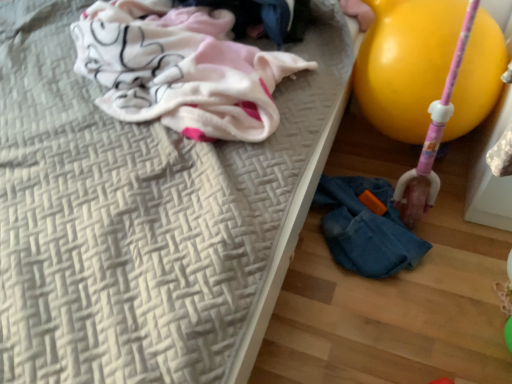
Question: Is denim jacket at lower right not within yellow rubber balloon at right?

Choices:
 (A) yes
 (B) no

Answer: (A)

Question: Can you confirm if denim jacket at lower right is positioned to the right of yellow rubber balloon at right?

Choices:
 (A) yes
 (B) no

Answer: (B)

Question: Considering the relative positions of denim jacket at lower right and yellow rubber balloon at right in the image provided, is denim jacket at lower right in front of yellow rubber balloon at right?

Choices:
 (A) yes
 (B) no

Answer: (B)

Question: Is denim jacket at lower right directly adjacent to yellow rubber balloon at right?

Choices:
 (A) no
 (B) yes

Answer: (A)

Question: Considering the relative sizes of denim jacket at lower right and yellow rubber balloon at right in the image provided, is denim jacket at lower right smaller than yellow rubber balloon at right?

Choices:
 (A) no
 (B) yes

Answer: (B)

Question: From a real-world perspective, relative to yellow rubber balloon at right, is denim jacket at lower right vertically above or below?

Choices:
 (A) above
 (B) below

Answer: (B)

Question: Is denim jacket at lower right in front of or behind yellow rubber balloon at right in the image?

Choices:
 (A) behind
 (B) front

Answer: (A)

Question: Considering the positions of denim jacket at lower right and yellow rubber balloon at right in the image, is denim jacket at lower right wider or thinner than yellow rubber balloon at right?

Choices:
 (A) wide
 (B) thin

Answer: (A)

Question: Is denim jacket at lower right spatially inside yellow rubber balloon at right, or outside of it?

Choices:
 (A) outside
 (B) inside

Answer: (A)

Question: Considering their positions, is yellow rubber balloon at right located in front of or behind denim jacket at lower right?

Choices:
 (A) behind
 (B) front

Answer: (B)

Question: Considering the positions of yellow rubber balloon at right and denim jacket at lower right in the image, is yellow rubber balloon at right bigger or smaller than denim jacket at lower right?

Choices:
 (A) small
 (B) big

Answer: (B)

Question: From a real-world perspective, relative to denim jacket at lower right, is yellow rubber balloon at right vertically above or below?

Choices:
 (A) below
 (B) above

Answer: (B)

Question: In terms of height, does yellow rubber balloon at right look taller or shorter compared to denim jacket at lower right?

Choices:
 (A) short
 (B) tall

Answer: (B)

Question: Which is correct: white woven mattress at upper left is inside white cotton cloth at upper left, or outside of it?

Choices:
 (A) inside
 (B) outside

Answer: (B)

Question: Considering the positions of white woven mattress at upper left and white cotton cloth at upper left in the image, is white woven mattress at upper left bigger or smaller than white cotton cloth at upper left?

Choices:
 (A) big
 (B) small

Answer: (A)